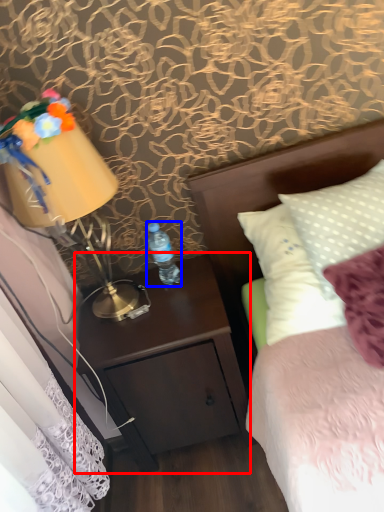
Question: Which point is closer to the camera, nightstand (highlighted by a red box) or bottle (highlighted by a blue box)?

Choices:
 (A) nightstand
 (B) bottle

Answer: (A)